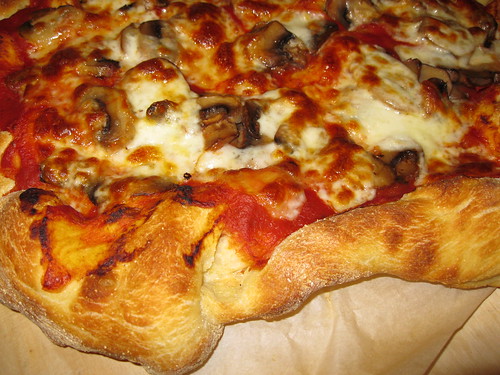
I want to click on crack in table, so click(x=443, y=348).